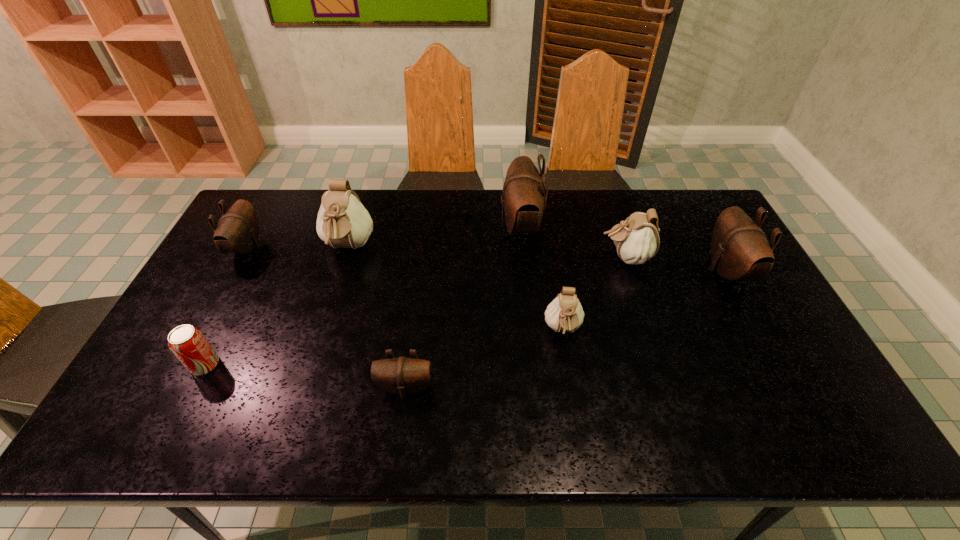
The image size is (960, 540). Find the location of `the fourth closest brown pouch relative to the soda can`. the fourth closest brown pouch relative to the soda can is located at coordinates (739, 248).

Choose which white pouch is the nearest neighbor to the second smallest brown pouch. Please provide its 2D coordinates. Your answer should be formatted as a tuple, i.e. [(x, y)], where the tuple contains the x and y coordinates of a point satisfying the conditions above.

[(343, 222)]

Identify the location of the second closest white pouch to the third nearest object. The height and width of the screenshot is (540, 960). (343, 222).

You are a GUI agent. You are given a task and a screenshot of the screen. Output one action in this format:
    pyautogui.click(x=<x>, y=<y>)
    Task: Click on the free spot that satisfies the following two spatial constraints: 1. with the flap open on the biggest brown pouch; 2. with the flap open on the third brown pouch from right to left
    The width and height of the screenshot is (960, 540).
    Given the screenshot: What is the action you would take?
    pyautogui.click(x=537, y=388)

Identify the location of free space in the image that satisfies the following two spatial constraints: 1. with the flap open on the soda can; 2. on the right side of the leftmost pouch. The image size is (960, 540). (183, 365).

Identify the location of vacant space that satisfies the following two spatial constraints: 1. on the front-facing side of the sixth pouch from right to left; 2. with the flap open on the leftmost pouch. (348, 248).